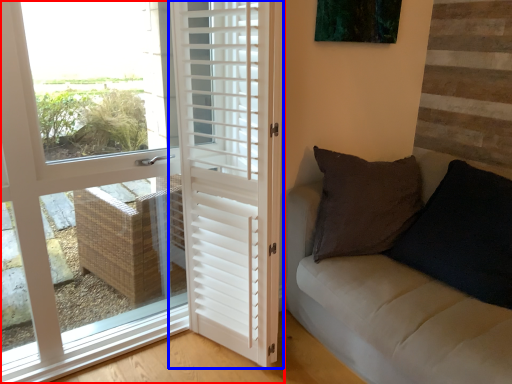
Question: Among these objects, which one is farthest to the camera, door (highlighted by a red box) or door (highlighted by a blue box)?

Choices:
 (A) door
 (B) door

Answer: (B)